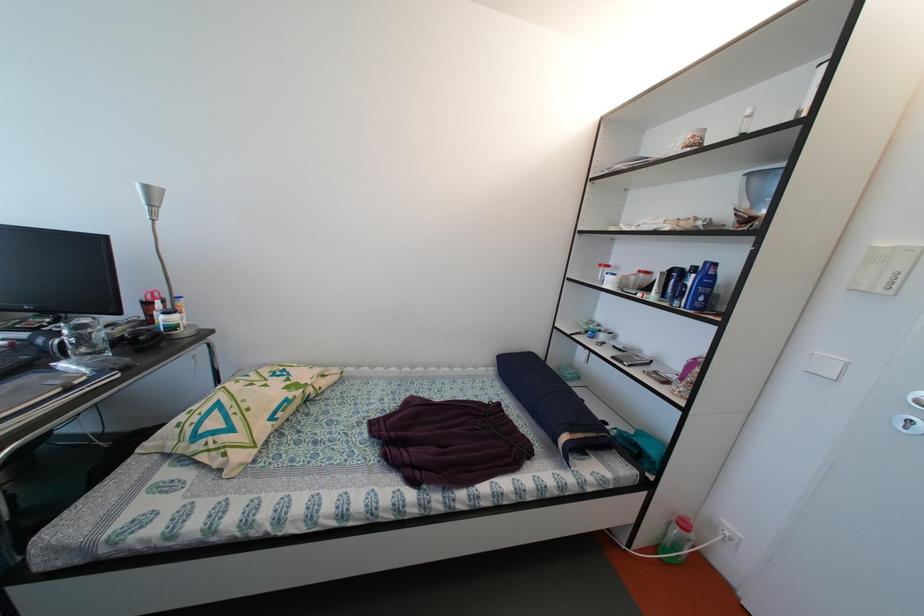
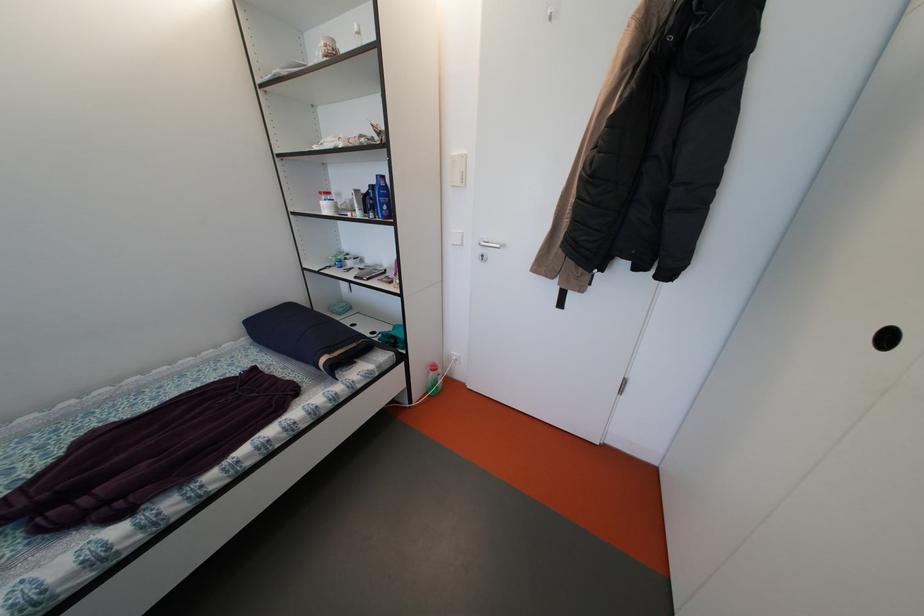
Find the pixel in the second image that matches [702,305] in the first image.

(390, 215)